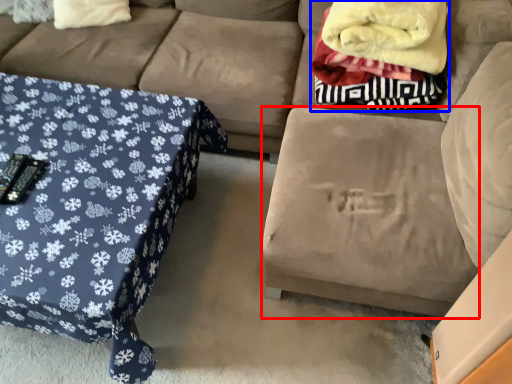
Question: Which of the following is the closest to the observer, footrest (highlighted by a red box) or blanket (highlighted by a blue box)?

Choices:
 (A) footrest
 (B) blanket

Answer: (A)